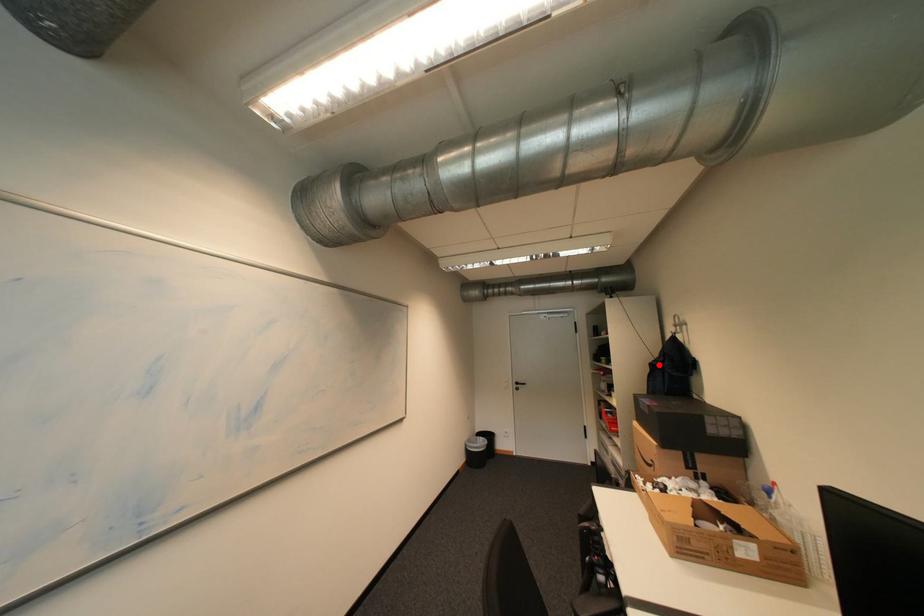
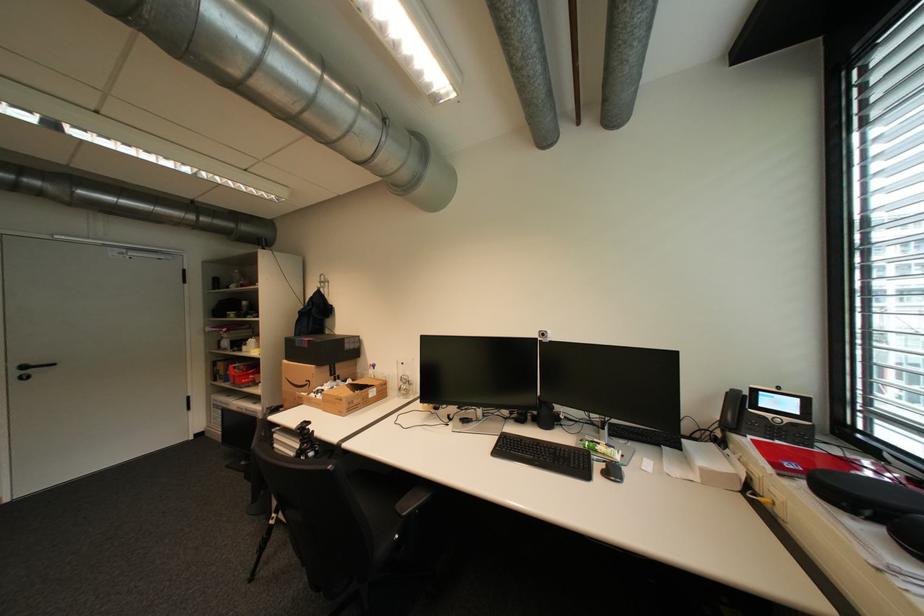
Locate, in the second image, the point that corresponds to the highlighted location in the first image.

(308, 312)